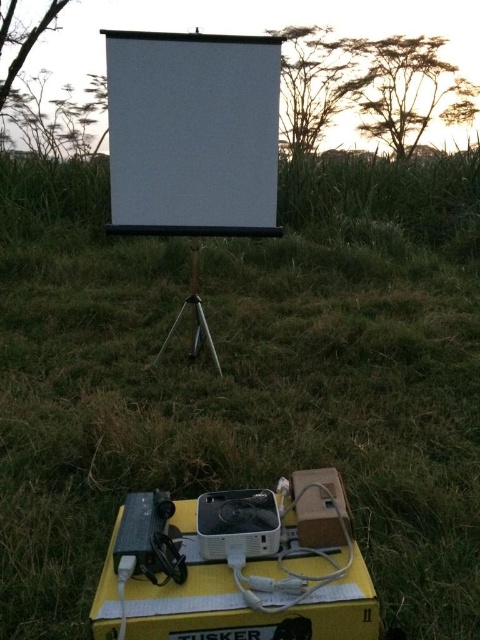
Question: Which object is the farthest from the white matte projector screen at center?

Choices:
 (A) white plastic projector at lower center
 (B) silver metallic tripod at center

Answer: (A)

Question: Observing the image, what is the correct spatial positioning of white plastic projector at lower center in reference to silver metallic tripod at center?

Choices:
 (A) above
 (B) below

Answer: (B)

Question: Which of the following is the farthest from the observer?

Choices:
 (A) (131, 76)
 (B) (196, 300)

Answer: (B)

Question: Does white plastic projector at lower center lie behind silver metallic tripod at center?

Choices:
 (A) yes
 (B) no

Answer: (B)

Question: Among these points, which one is farthest from the camera?

Choices:
 (A) (336, 570)
 (B) (115, 218)
 (C) (195, 291)

Answer: (C)

Question: Observing the image, what is the correct spatial positioning of white plastic projector at lower center in reference to silver metallic tripod at center?

Choices:
 (A) left
 (B) right

Answer: (B)